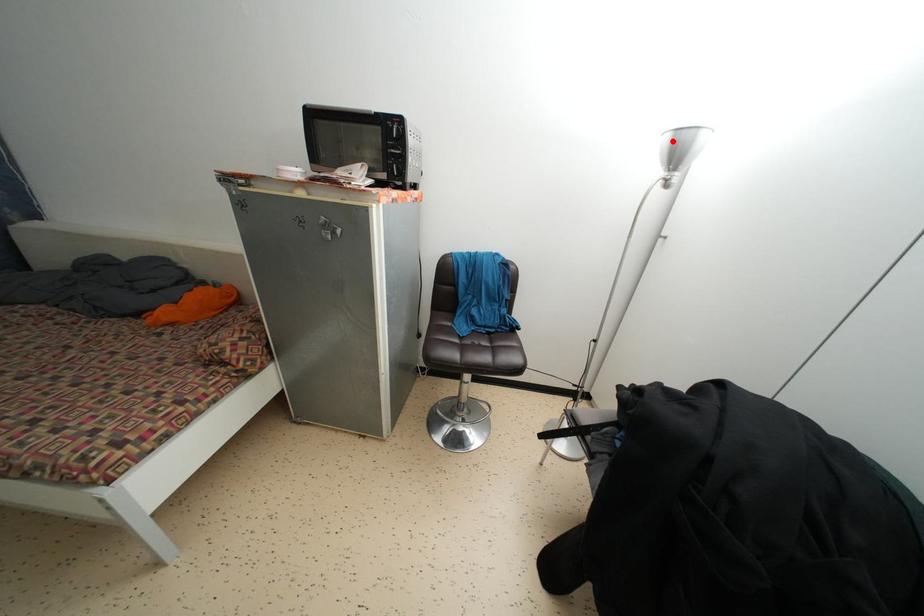
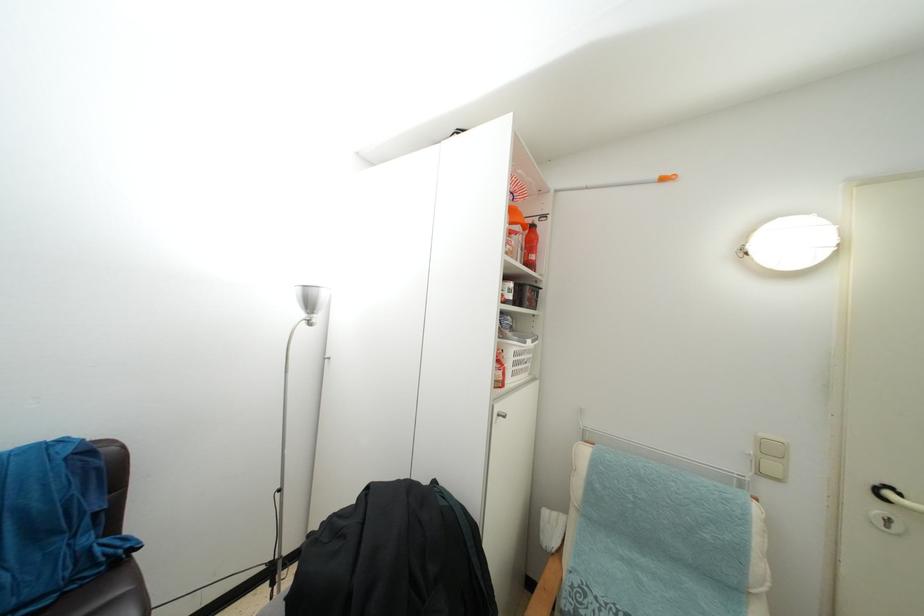
Question: I am providing you with two images of the same scene from different viewpoints. A red point is marked on the first image. Can you still see the location of the red point in image 2?

Choices:
 (A) Yes
 (B) No

Answer: (A)